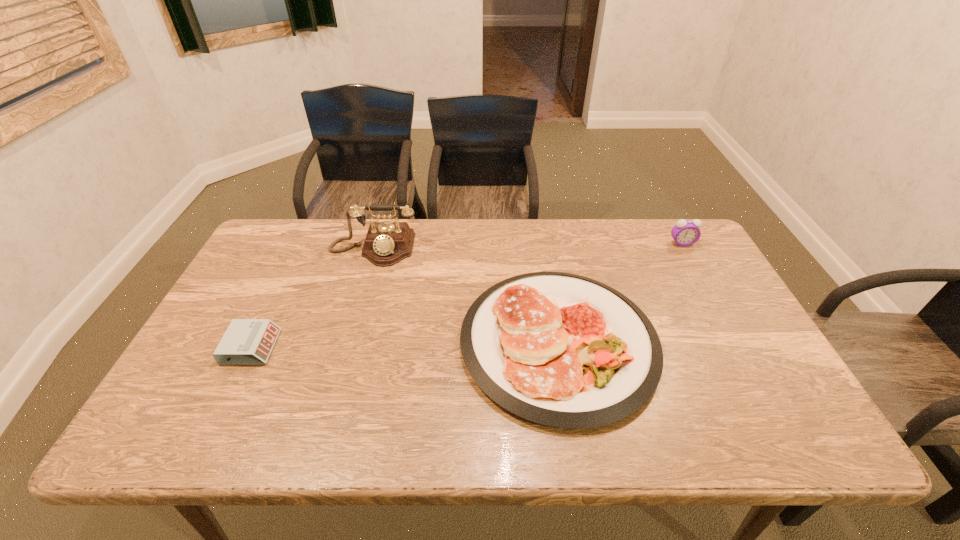
Where is `vacant area that lies between the shorter alarm clock and the telephone`? This screenshot has height=540, width=960. vacant area that lies between the shorter alarm clock and the telephone is located at coordinates (312, 298).

What are the coordinates of `free point between the second object from left to right and the left alarm clock` in the screenshot? It's located at (312, 298).

You are a GUI agent. You are given a task and a screenshot of the screen. Output one action in this format:
    pyautogui.click(x=<x>, y=<y>)
    Task: Click on the vacant area that lies between the dish and the leftmost object
    
    Given the screenshot: What is the action you would take?
    coord(405,345)

Image resolution: width=960 pixels, height=540 pixels. I want to click on the second closest object to the leftmost object, so click(x=558, y=349).

Locate which object ranks in proximity to the shorter alarm clock. Please provide its 2D coordinates. Your answer should be formatted as a tuple, i.e. [(x, y)], where the tuple contains the x and y coordinates of a point satisfying the conditions above.

[(387, 243)]

This screenshot has width=960, height=540. What are the coordinates of `free space in the image that satisfies the following two spatial constraints: 1. on the dial of the tallest object; 2. on the right side of the third object from left to right` in the screenshot? It's located at (347, 342).

Locate an element on the screen. The height and width of the screenshot is (540, 960). vacant region that satisfies the following two spatial constraints: 1. on the dial of the second object from right to left; 2. on the left side of the telephone is located at coordinates (347, 342).